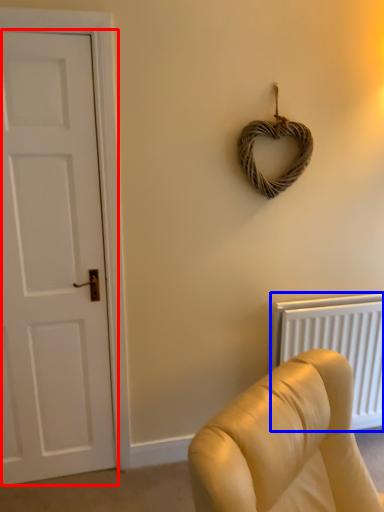
Question: Among these objects, which one is nearest to the camera, door (highlighted by a red box) or radiator (highlighted by a blue box)?

Choices:
 (A) door
 (B) radiator

Answer: (A)